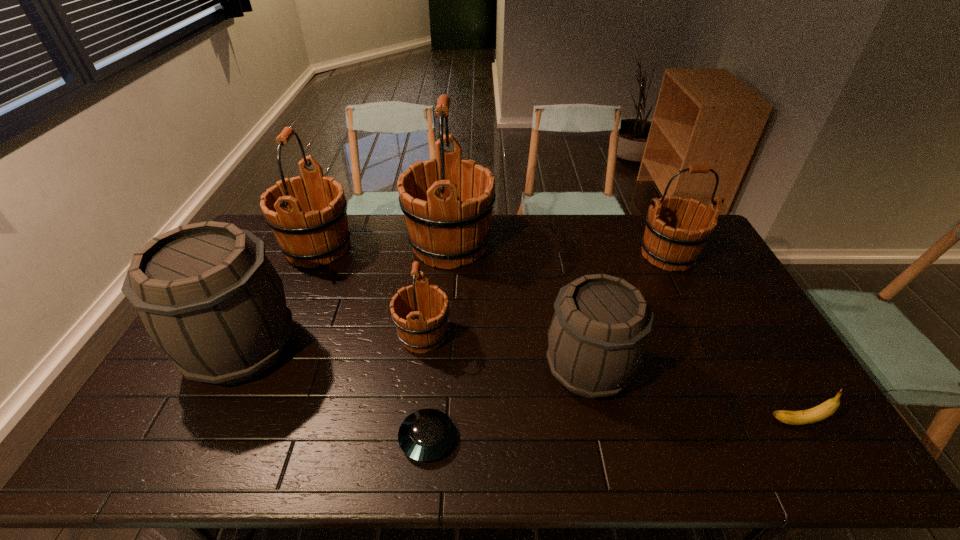
Locate an element on the screen. This screenshot has height=540, width=960. vacant area at the near edge of the desktop is located at coordinates (641, 442).

You are a GUI agent. You are given a task and a screenshot of the screen. Output one action in this format:
    pyautogui.click(x=<x>, y=<y>)
    Task: Click on the vacant space at the left edge of the desktop
    The width and height of the screenshot is (960, 540).
    Given the screenshot: What is the action you would take?
    pyautogui.click(x=162, y=403)

The width and height of the screenshot is (960, 540). I want to click on vacant space at the near right corner of the desktop, so click(x=770, y=444).

The image size is (960, 540). Identify the location of empty space between the left brown wine bucket and the banana. (519, 385).

In order to click on vacant space that's between the biggest wood wine bucket and the sixth object from left to right in this screenshot , I will do `click(519, 307)`.

This screenshot has width=960, height=540. I want to click on vacant area that lies between the smaller brown wine bucket and the gray saucer, so click(x=508, y=403).

What are the coordinates of `unoccupied position between the second wine bucket from right to left and the saucer` in the screenshot? It's located at (508, 403).

At what (x,y) coordinates should I click in order to perform the action: click on free area in between the left brown wine bucket and the gray saucer. Please return your answer as a coordinate pair (x, y). Image resolution: width=960 pixels, height=540 pixels. Looking at the image, I should click on (335, 393).

At what (x,y) coordinates should I click in order to perform the action: click on free space between the left brown wine bucket and the nearest wood wine bucket. Please return your answer as a coordinate pair (x, y). Looking at the image, I should click on (333, 342).

At what (x,y) coordinates should I click in order to perform the action: click on unoccupied area between the saucer and the third biggest wood wine bucket. Please return your answer as a coordinate pair (x, y). Looking at the image, I should click on (548, 347).